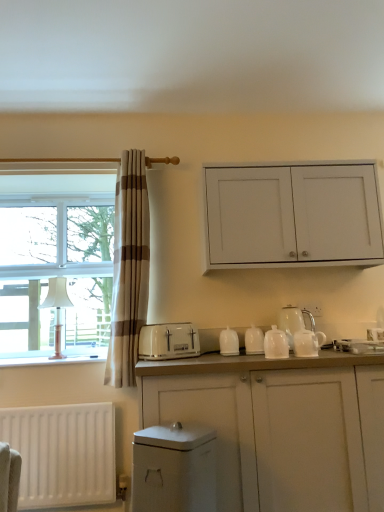
Question: Can you confirm if white glossy teapot at center, the 3th tableware from the back, is positioned to the right of white matte cabinet at upper right, which appears as the 2th cabinetry when ordered from the bottom?

Choices:
 (A) yes
 (B) no

Answer: (B)

Question: Is white glossy teapot at center, which appears as the first tableware when viewed from the front, shorter than white matte cabinet at upper right, which appears as the 2th cabinetry when ordered from the bottom?

Choices:
 (A) yes
 (B) no

Answer: (A)

Question: From a real-world perspective, is white glossy teapot at center, which appears as the first tableware when viewed from the front, under white matte cabinet at upper right, the first cabinetry when ordered from top to bottom?

Choices:
 (A) yes
 (B) no

Answer: (A)

Question: Can you confirm if white glossy teapot at center, the 3th tableware from the back, is positioned to the left of white matte cabinet at upper right, which appears as the 2th cabinetry when ordered from the bottom?

Choices:
 (A) no
 (B) yes

Answer: (B)

Question: Considering the relative sizes of white glossy teapot at center, the 3th tableware from the back, and white matte cabinet at upper right, the first cabinetry when ordered from top to bottom, in the image provided, is white glossy teapot at center, the 3th tableware from the back, thinner than white matte cabinet at upper right, the first cabinetry when ordered from top to bottom,?

Choices:
 (A) yes
 (B) no

Answer: (A)

Question: Looking at the image, does white glossy dishwasher at lower center seem bigger or smaller compared to white plastic toaster at center?

Choices:
 (A) big
 (B) small

Answer: (A)

Question: From a real-world perspective, is white glossy dishwasher at lower center positioned above or below white plastic toaster at center?

Choices:
 (A) below
 (B) above

Answer: (A)

Question: In the image, is white glossy dishwasher at lower center on the left side or the right side of white plastic toaster at center?

Choices:
 (A) right
 (B) left

Answer: (A)

Question: Considering the positions of point (190, 502) and point (165, 325), is point (190, 502) closer or farther from the camera than point (165, 325)?

Choices:
 (A) farther
 (B) closer

Answer: (B)

Question: Would you say white fabric lampshade at left is to the left or to the right of white glossy teapot at right, placed as the first tea pot when sorted from front to back, in the picture?

Choices:
 (A) left
 (B) right

Answer: (A)

Question: Is white fabric lampshade at left in front of or behind white glossy teapot at right, placed as the first tea pot when sorted from front to back, in the image?

Choices:
 (A) front
 (B) behind

Answer: (B)

Question: Does point (66, 282) appear closer or farther from the camera than point (309, 315)?

Choices:
 (A) closer
 (B) farther

Answer: (B)

Question: Is white fabric lampshade at left inside the boundaries of white glossy teapot at right, placed as the first tea pot when sorted from front to back, or outside?

Choices:
 (A) outside
 (B) inside

Answer: (A)

Question: Is white glossy teapot at right, the 2th tea pot when ordered from back to front, in front of or behind white glossy tea pot at right, which ranks as the first tea pot in back-to-front order, in the image?

Choices:
 (A) behind
 (B) front

Answer: (B)

Question: From a real-world perspective, is white glossy teapot at right, placed as the first tea pot when sorted from front to back, above or below white glossy tea pot at right, the second tea pot when ordered from front to back?

Choices:
 (A) below
 (B) above

Answer: (A)